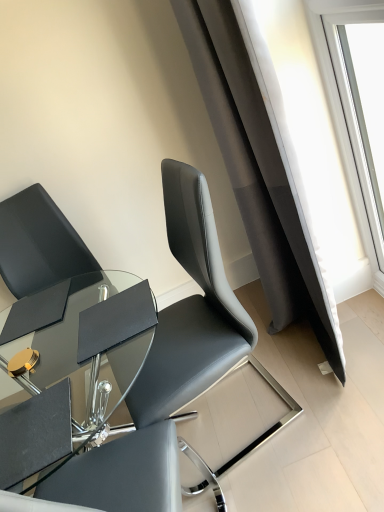
Question: Is matte black chair at upper left, the second chair from the left, to the right of black leather chair at left, positioned as the 2th chair in right-to-left order, from the viewer's perspective?

Choices:
 (A) no
 (B) yes

Answer: (B)

Question: Does matte black chair at upper left, the second chair from the left, lie behind black leather chair at left, the first chair when ordered from left to right?

Choices:
 (A) yes
 (B) no

Answer: (B)

Question: Is matte black chair at upper left, which is the first chair from right to left, not inside black leather chair at left, the first chair when ordered from left to right?

Choices:
 (A) no
 (B) yes

Answer: (B)

Question: Would you say matte black chair at upper left, which is the first chair from right to left, contains black leather chair at left, the first chair when ordered from left to right?

Choices:
 (A) no
 (B) yes

Answer: (A)

Question: Does matte black chair at upper left, which is the first chair from right to left, touch black leather chair at left, the first chair when ordered from left to right?

Choices:
 (A) no
 (B) yes

Answer: (A)

Question: In terms of height, does transparent glass window at upper right look taller or shorter compared to matte black chair at upper left, which is the first chair from right to left?

Choices:
 (A) tall
 (B) short

Answer: (A)

Question: From a real-world perspective, is transparent glass window at upper right above or below matte black chair at upper left, which is the first chair from right to left?

Choices:
 (A) below
 (B) above

Answer: (B)

Question: From the image's perspective, relative to matte black chair at upper left, the second chair from the left, is transparent glass window at upper right above or below?

Choices:
 (A) above
 (B) below

Answer: (A)

Question: Considering their positions, is transparent glass window at upper right located in front of or behind matte black chair at upper left, the second chair from the left?

Choices:
 (A) front
 (B) behind

Answer: (B)

Question: From a real-world perspective, relative to matte black chair at upper left, which is the first chair from right to left, is black leather chair at left, positioned as the 2th chair in right-to-left order, vertically above or below?

Choices:
 (A) above
 (B) below

Answer: (B)

Question: Considering the positions of black leather chair at left, the first chair when ordered from left to right, and matte black chair at upper left, which is the first chair from right to left, in the image, is black leather chair at left, the first chair when ordered from left to right, wider or thinner than matte black chair at upper left, which is the first chair from right to left,?

Choices:
 (A) wide
 (B) thin

Answer: (A)

Question: Is black leather chair at left, the first chair when ordered from left to right, inside the boundaries of matte black chair at upper left, which is the first chair from right to left, or outside?

Choices:
 (A) inside
 (B) outside

Answer: (B)

Question: In terms of size, does black leather chair at left, positioned as the 2th chair in right-to-left order, appear bigger or smaller than matte black chair at upper left, the second chair from the left?

Choices:
 (A) small
 (B) big

Answer: (A)

Question: From a real-world perspective, is matte black chair at upper left, which is the first chair from right to left, above or below black leather chair at left, positioned as the 2th chair in right-to-left order?

Choices:
 (A) below
 (B) above

Answer: (B)

Question: Based on their sizes in the image, would you say matte black chair at upper left, which is the first chair from right to left, is bigger or smaller than black leather chair at left, the first chair when ordered from left to right?

Choices:
 (A) small
 (B) big

Answer: (B)